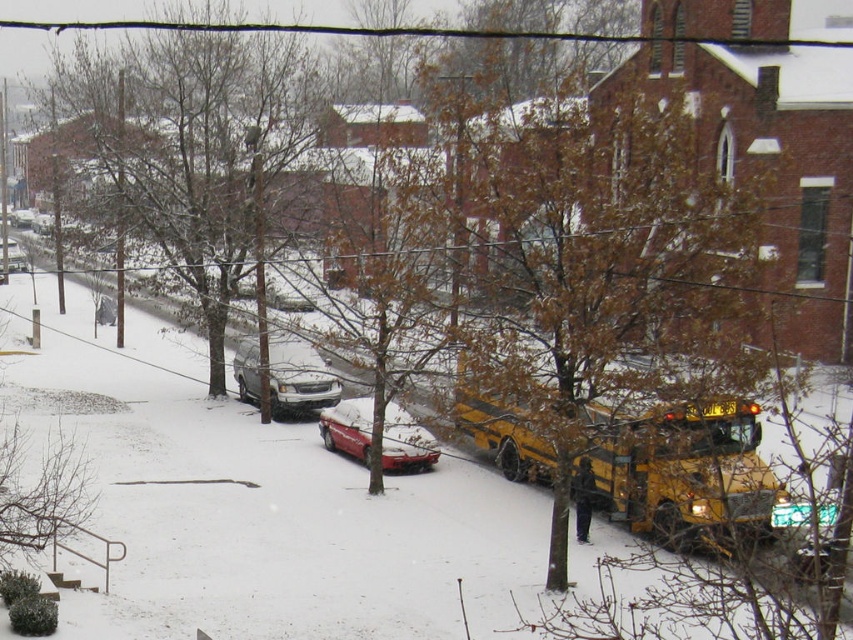
You are a delivery person trying to park your delivery van behind the yellow matte school bus at center and the shiny red car at center. Which vehicle should you park behind to have enough clearance for your van?

You should park behind the shiny red car at center because the yellow matte school bus at center is much taller, which may not leave enough vertical clearance for your van.

You are standing at the camera position looking at the snowy street scene. There are two points marked in the image, one at coordinates point (679, 532) and the other at point (413, 419). Which of these two points is closer to you?

Point (679, 532) is closer to the camera than point (413, 419).